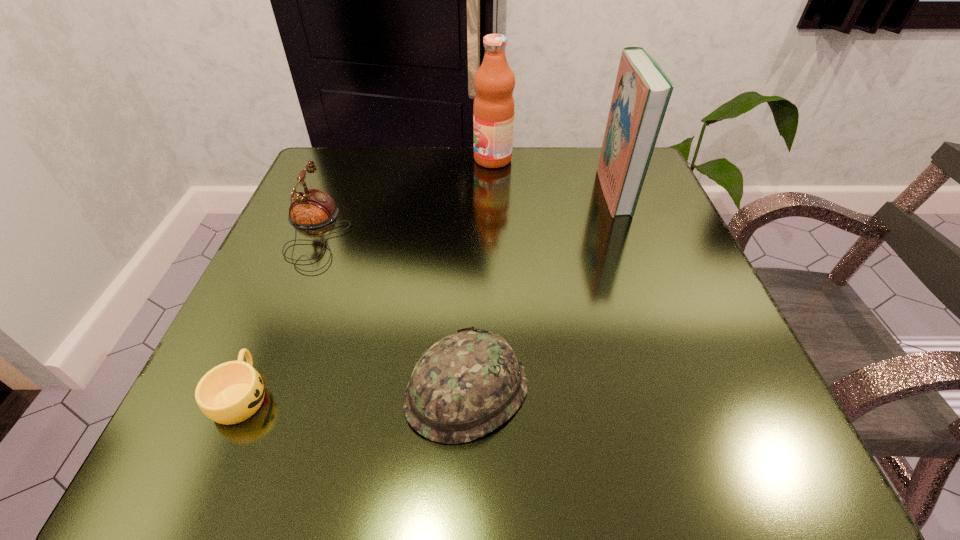
Where is `empty location between the fruit juice and the telephone`? The height and width of the screenshot is (540, 960). empty location between the fruit juice and the telephone is located at coordinates (404, 195).

Identify the location of object that stands as the closest to the telephone. (231, 392).

The width and height of the screenshot is (960, 540). In order to click on object that is the second closest to the fruit juice in this screenshot , I will do `click(311, 208)`.

Identify the location of vacant space that satisfies the following two spatial constraints: 1. on the front label of the fruit juice; 2. on the front side of the headwear. (502, 390).